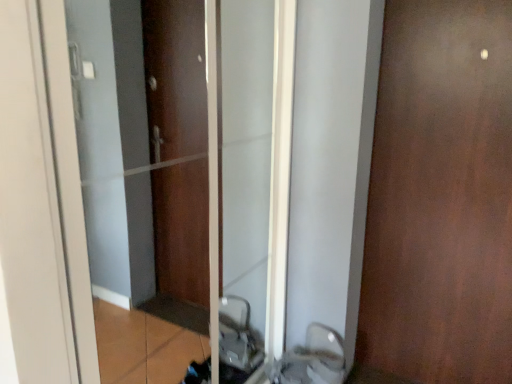
Question: Is brown matte door at right taller than matte brown elevator at center?

Choices:
 (A) no
 (B) yes

Answer: (B)

Question: Does brown matte door at right have a smaller size compared to matte brown elevator at center?

Choices:
 (A) yes
 (B) no

Answer: (A)

Question: Is matte brown elevator at center at the back of brown matte door at right?

Choices:
 (A) no
 (B) yes

Answer: (A)

Question: From the image's perspective, is brown matte door at right located beneath matte brown elevator at center?

Choices:
 (A) no
 (B) yes

Answer: (A)

Question: Can you confirm if brown matte door at right is positioned to the right of matte brown elevator at center?

Choices:
 (A) yes
 (B) no

Answer: (A)

Question: Choose the correct answer: Is brown matte door at right inside white glossy sink at lower center or outside it?

Choices:
 (A) inside
 (B) outside

Answer: (B)

Question: From the image's perspective, is brown matte door at right above or below white glossy sink at lower center?

Choices:
 (A) below
 (B) above

Answer: (B)

Question: Considering the positions of brown matte door at right and white glossy sink at lower center in the image, is brown matte door at right bigger or smaller than white glossy sink at lower center?

Choices:
 (A) big
 (B) small

Answer: (A)

Question: Is point (494, 251) closer or farther from the camera than point (321, 372)?

Choices:
 (A) closer
 (B) farther

Answer: (A)

Question: Does point (378, 168) appear closer or farther from the camera than point (234, 107)?

Choices:
 (A) farther
 (B) closer

Answer: (B)

Question: In terms of width, does brown matte door at right look wider or thinner when compared to matte brown elevator at center?

Choices:
 (A) wide
 (B) thin

Answer: (B)

Question: Would you say brown matte door at right is to the left or to the right of matte brown elevator at center in the picture?

Choices:
 (A) left
 (B) right

Answer: (B)

Question: From the image's perspective, is brown matte door at right positioned above or below matte brown elevator at center?

Choices:
 (A) below
 (B) above

Answer: (B)

Question: Choose the correct answer: Is white glossy sink at lower center inside matte brown elevator at center or outside it?

Choices:
 (A) inside
 (B) outside

Answer: (B)

Question: Looking at the image, does white glossy sink at lower center seem bigger or smaller compared to matte brown elevator at center?

Choices:
 (A) big
 (B) small

Answer: (B)